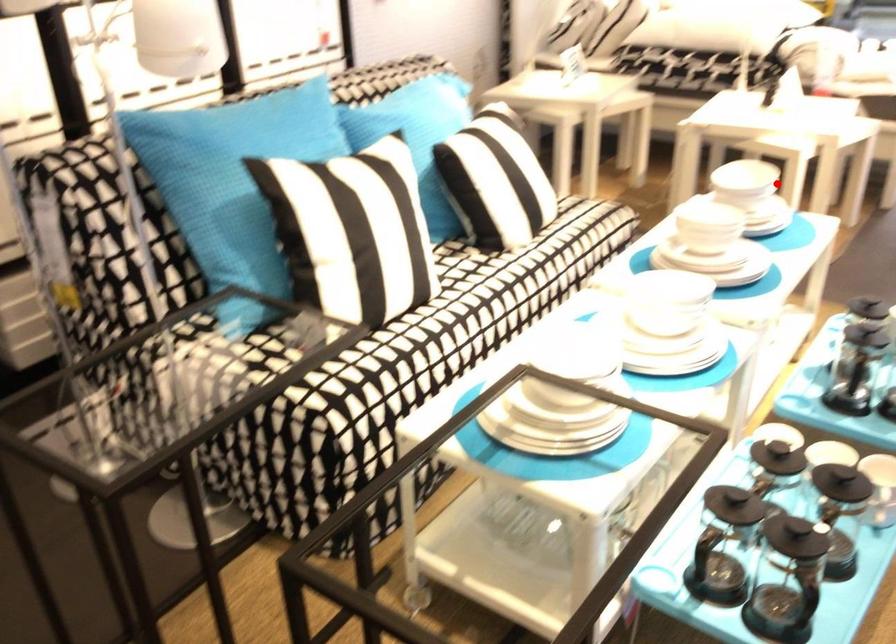
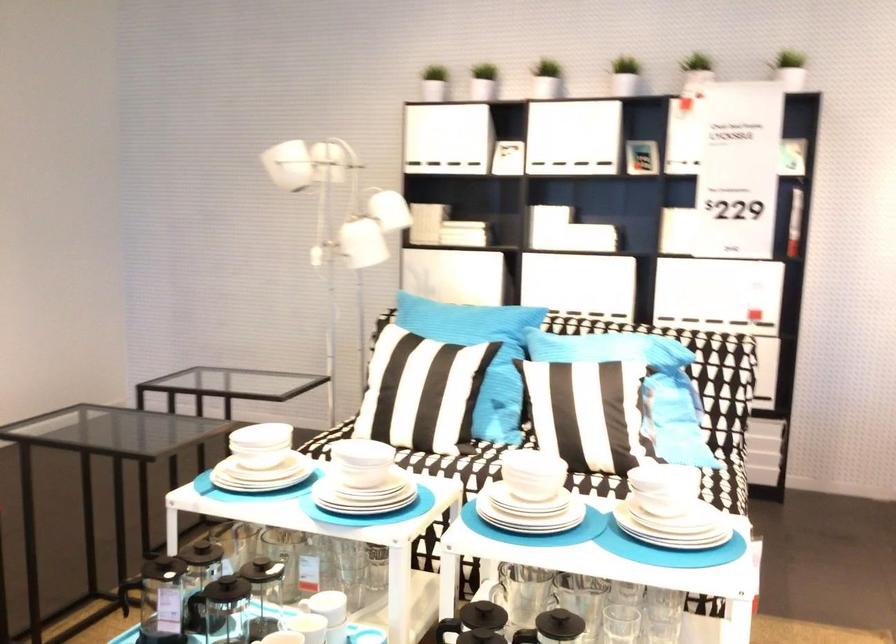
Question: I am providing you with two images of the same scene from different viewpoints. Given a red point in image1, look at the same physical point in image2. Is it:

Choices:
 (A) Closer to the viewpoint
 (B) Farther from the viewpoint

Answer: (A)